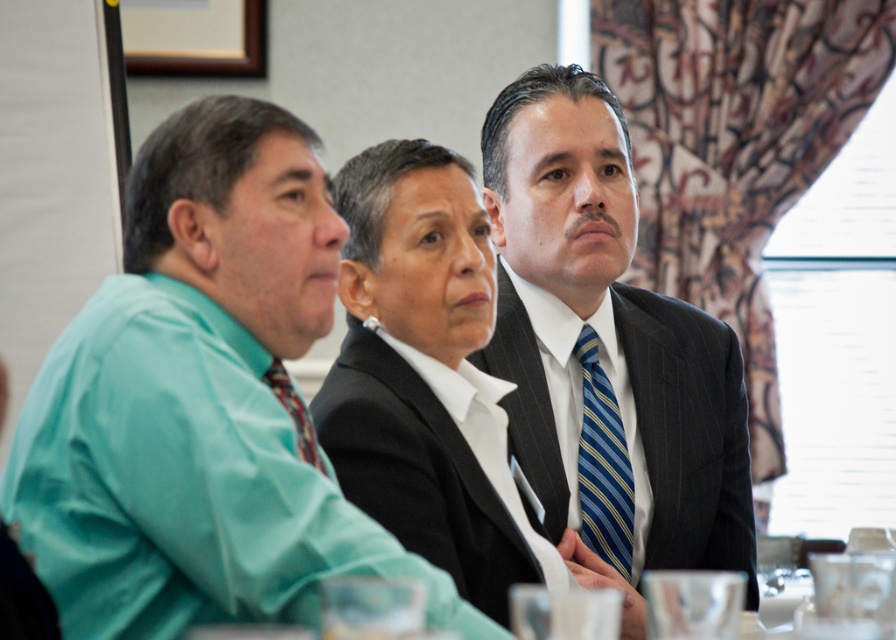
You are planning to attend a formal event and need to choose between the dark gray pinstripe suit at center and the dark gray suit at center. Based on the image, which one has a wider cut?

The dark gray pinstripe suit at center has a wider cut than the dark gray suit at center according to the image.

You are a photographer setting up for a group photo in the conference room. You have two points marked on your camera screen at coordinates point (557, 77) and point (392, 198). Which point is closer to the camera?

Point (557, 77) is further to the camera than point (392, 198), so the point closer to the camera is point (392, 198).

You are organizing a photo shoot and need to ensure that all clothing items in the image are appropriately sized for the models. Given the scene described, which clothing item is larger in size between the teal fabric shirt at left and the dark gray suit at center?

The teal fabric shirt at left is larger in size compared to the dark gray suit at center, as stated in the description.